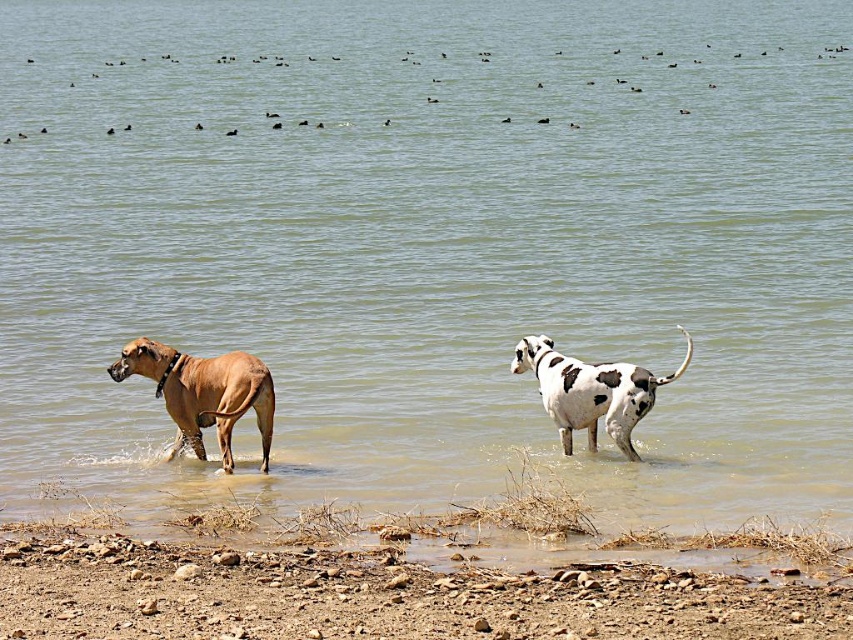
You are standing at the origin point of the coordinate system. Where is the brown smooth coat dog at left located?

The brown smooth coat dog at left is located at point (x=202, y=392).

You are standing at the camera position and want to throw a ball to the brown smooth coat dog at left. If your throwing range is 10 meters, will you be able to reach the dog?

The distance between the brown smooth coat dog at left and the camera is 10.70 meters, which exceeds your throwing range of 10 meters. Therefore, you won